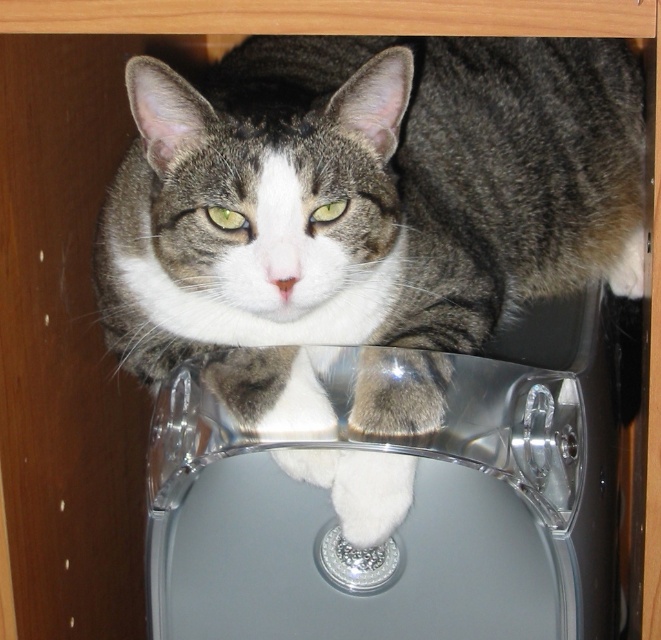
The width and height of the screenshot is (661, 640). Describe the element at coordinates (364, 212) in the screenshot. I see `tabby fur cat at center` at that location.

Between point (584, 77) and point (559, 564), which one is positioned behind?

Point (584, 77)

Locate an element on the screen. This screenshot has width=661, height=640. tabby fur cat at center is located at coordinates (364, 212).